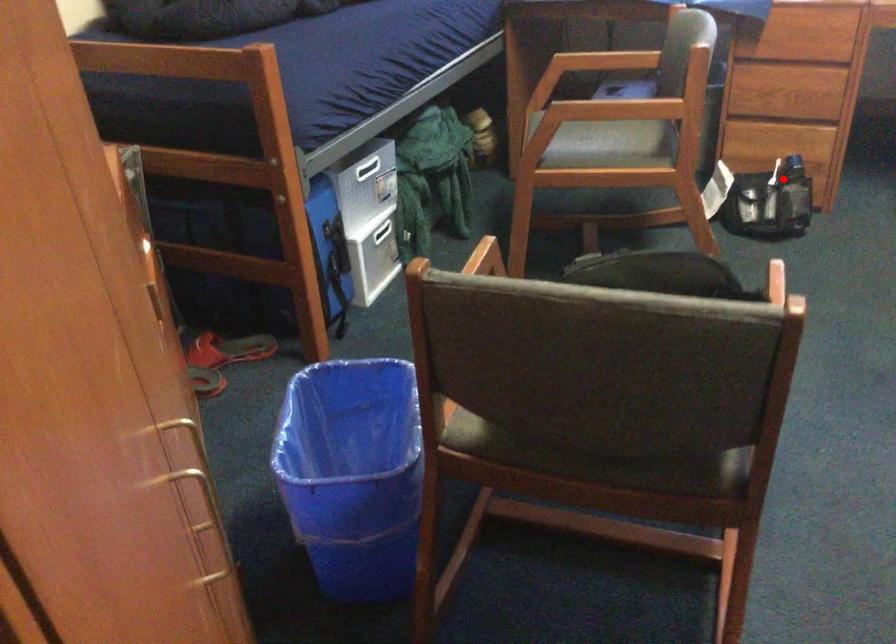
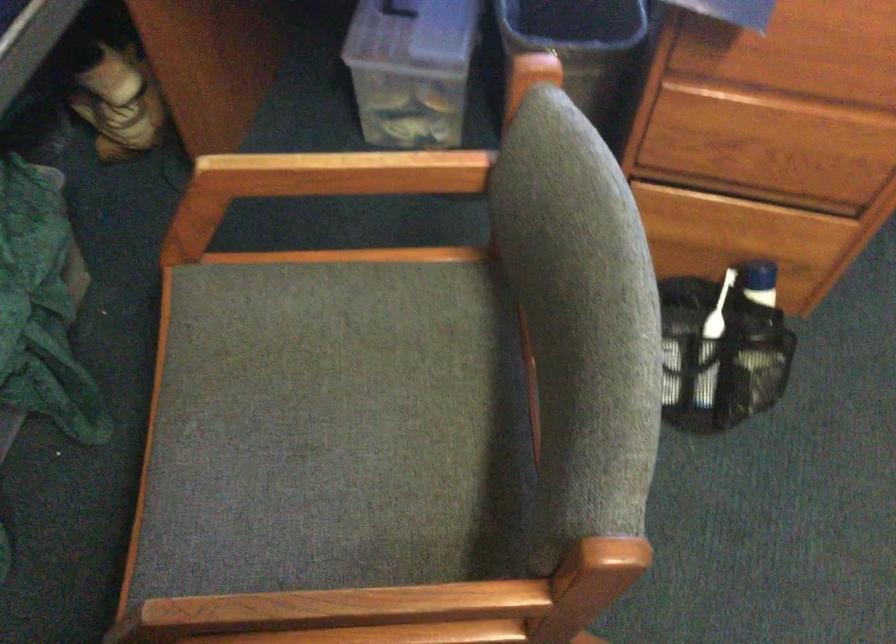
Question: I am providing you with two images of the same scene from different viewpoints. Image1 has a red point marked. In image2, the corresponding 3D location appears at what relative position? Reply with the corresponding letter.

Choices:
 (A) Closer
 (B) Farther

Answer: (A)